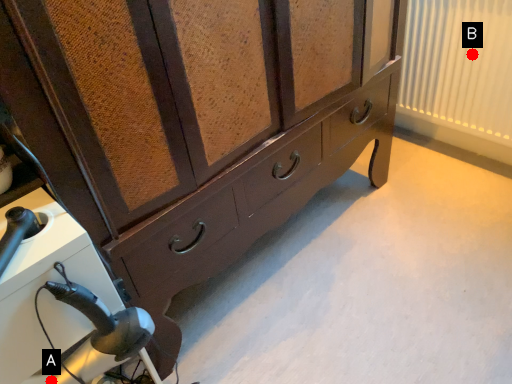
Question: Two points are circled on the image, labeled by A and B beside each circle. Among these points, which one is nearest to the camera?

Choices:
 (A) A is closer
 (B) B is closer

Answer: (A)